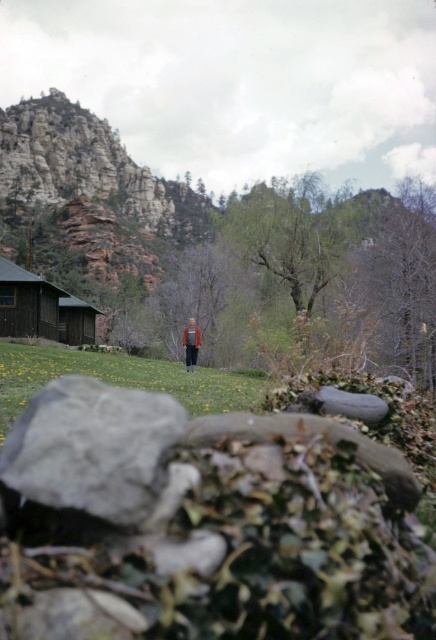
You are planning to take a photo of the dark brown wooden cabin at left and the gray rough rock at lower left. Which object should you position to the left side of your camera frame to include both in the shot?

You should position the dark brown wooden cabin at left to the left side of your camera frame because the gray rough rock at lower left is to the right of it, ensuring both fit within the frame.

You are a photographer trying to capture the gray rough rock at lower left and the dark brown leather jacket at center in the same frame. Which object is wider?

The gray rough rock at lower left is wider than the dark brown leather jacket at center.

You are a hiker trying to navigate through the gray rough rock at lower left and the green grass at center. Which path would require more caution due to uneven terrain?

The gray rough rock at lower left requires more caution because it has a smaller size compared to the green grass at center, making it potentially unstable underfoot.